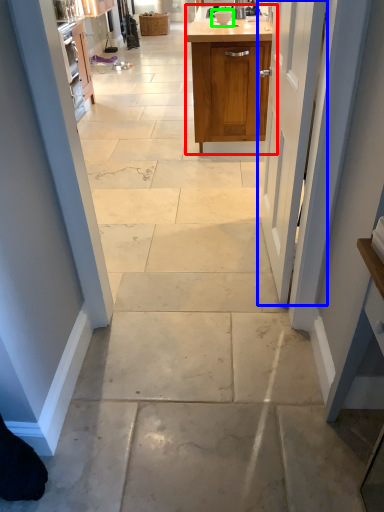
Question: Which is nearer to the cabinetry (highlighted by a red box)? door (highlighted by a blue box) or appliance (highlighted by a green box).

Choices:
 (A) door
 (B) appliance

Answer: (B)